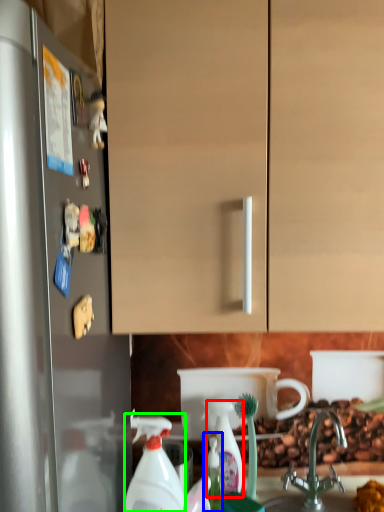
Question: Estimate the real-world distances between objects in this image. Which object is farther from cleaning product (highlighted by a red box), bottle (highlighted by a blue box) or cleaning product (highlighted by a green box)?

Choices:
 (A) bottle
 (B) cleaning product

Answer: (B)